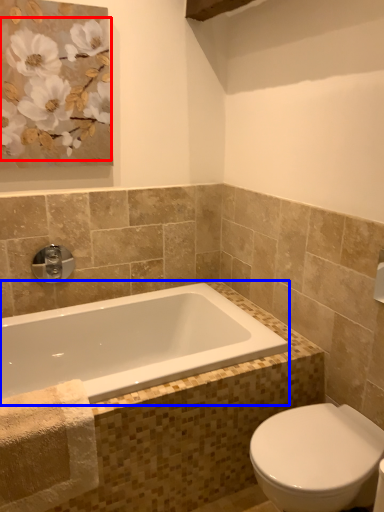
Question: Which object is further to the camera taking this photo, flower (highlighted by a red box) or bathtub (highlighted by a blue box)?

Choices:
 (A) flower
 (B) bathtub

Answer: (A)